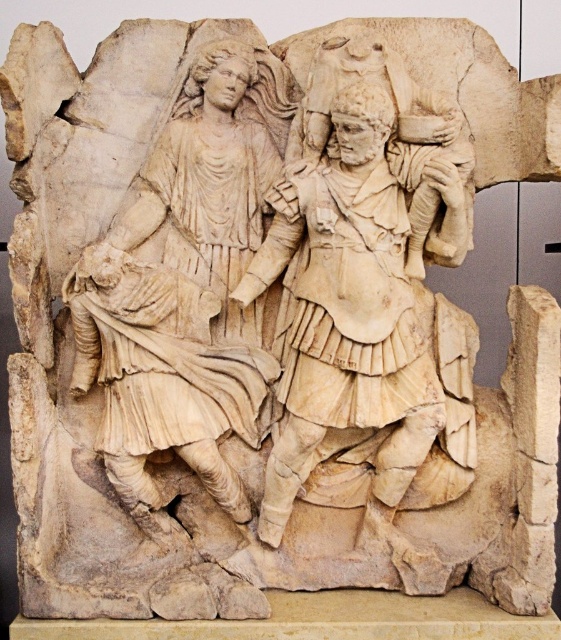
Based on the scene described, which object is thinner between the white marble figure at center and the white marble warrior at center?

The white marble figure at center is thinner than the white marble warrior at center according to the description.

Consider the image. You are an art conservator standing 10 feet away from the classical marble relief sculpture. You need to examine the white marble figure at center closely. Can you reach it without moving closer?

The white marble figure at center is 7.38 feet away from the viewer. Since you are standing 10 feet away, you are too far to reach it without moving closer.

From the picture: You are an art conservator examining the classical marble relief sculpture. You notice two points of interest marked on the image. The first point is at coordinates point (x=181, y=333), and the second is at point (x=404, y=218). From the viewer perspective, which point is closer to you?

Point (x=404, y=218) is closer to the viewer than point (x=181, y=333) because the description states that point (x=181, y=333) is behind point (x=404, y=218).